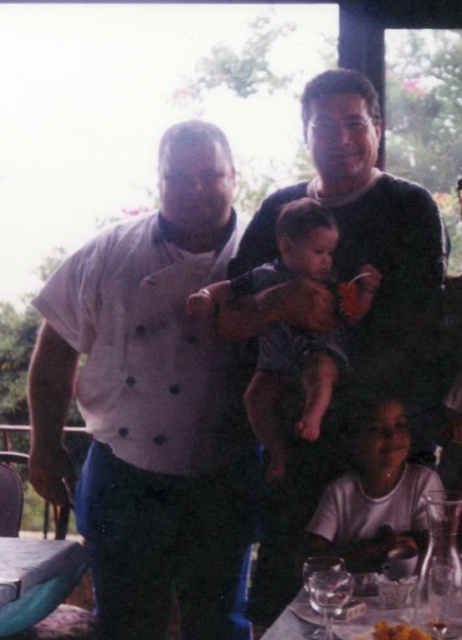
Consider the image. Does blue denim shorts at center have a larger size compared to clear glassware at lower center?

Yes.

Consider the image. Which is above, blue denim shorts at center or clear glassware at lower center?

blue denim shorts at center is above.

This screenshot has width=462, height=640. Describe the element at coordinates (289, 381) in the screenshot. I see `blue denim shorts at center` at that location.

At what (x,y) coordinates should I click in order to perform the action: click on blue denim shorts at center. Please return your answer as a coordinate pair (x, y). The width and height of the screenshot is (462, 640). Looking at the image, I should click on (289, 381).

Who is higher up, white button-up shirt at left or clear glass wine glass at lower center?

white button-up shirt at left is higher up.

Between white button-up shirt at left and clear glass wine glass at lower center, which one appears on the left side from the viewer's perspective?

white button-up shirt at left is more to the left.

Does point (189, 268) come farther from viewer compared to point (312, 572)?

Yes, it is.

Where is `white button-up shirt at left`? The width and height of the screenshot is (462, 640). white button-up shirt at left is located at coordinates (147, 401).

Who is shorter, white button-up shirt at left or clear glassware at lower center?

clear glassware at lower center is shorter.

Between white button-up shirt at left and clear glassware at lower center, which one appears on the left side from the viewer's perspective?

Positioned to the left is white button-up shirt at left.

Identify the location of white button-up shirt at left. This screenshot has height=640, width=462. 147,401.

At what (x,y) coordinates should I click in order to perform the action: click on white button-up shirt at left. Please return your answer as a coordinate pair (x, y). The image size is (462, 640). Looking at the image, I should click on (147, 401).